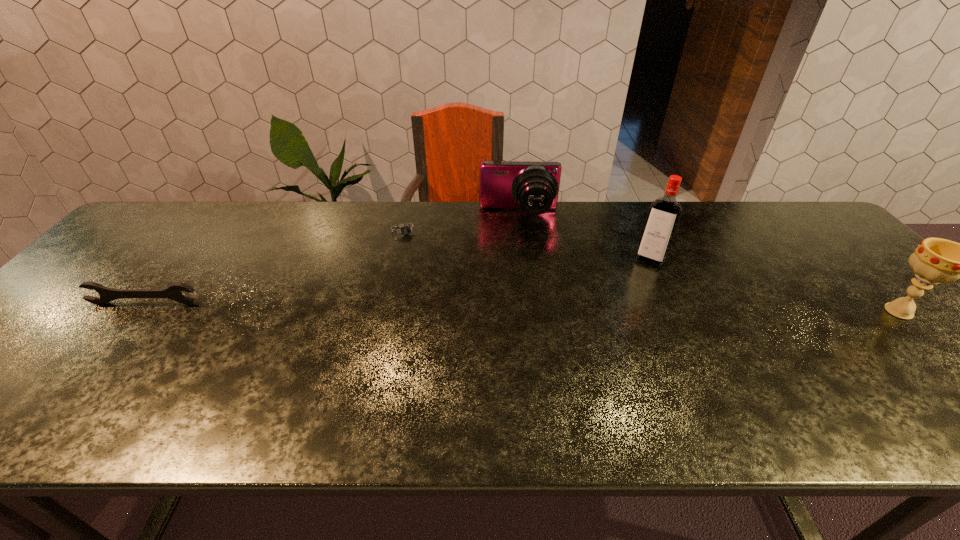
Find the location of a particular element. The height and width of the screenshot is (540, 960). free spot on the desktop that is between the leftmost object and the rightmost object and is positioned on the front and back of the vodka is located at coordinates (623, 308).

Where is `vacant space on the desktop that is between the fourth tallest object and the chalice and is positioned on the face of the watch`? vacant space on the desktop that is between the fourth tallest object and the chalice and is positioned on the face of the watch is located at coordinates [439, 307].

Identify the location of free space on the desktop that is between the wrench and the fourth shortest object and is positioned on the front-facing side of the third shortest object. (524, 307).